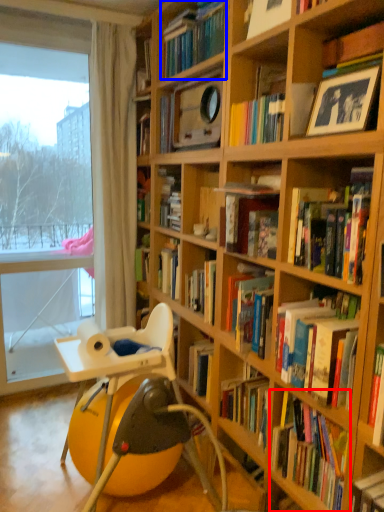
Question: Which of the following is the closest to the observer, book (highlighted by a red box) or book (highlighted by a blue box)?

Choices:
 (A) book
 (B) book

Answer: (A)